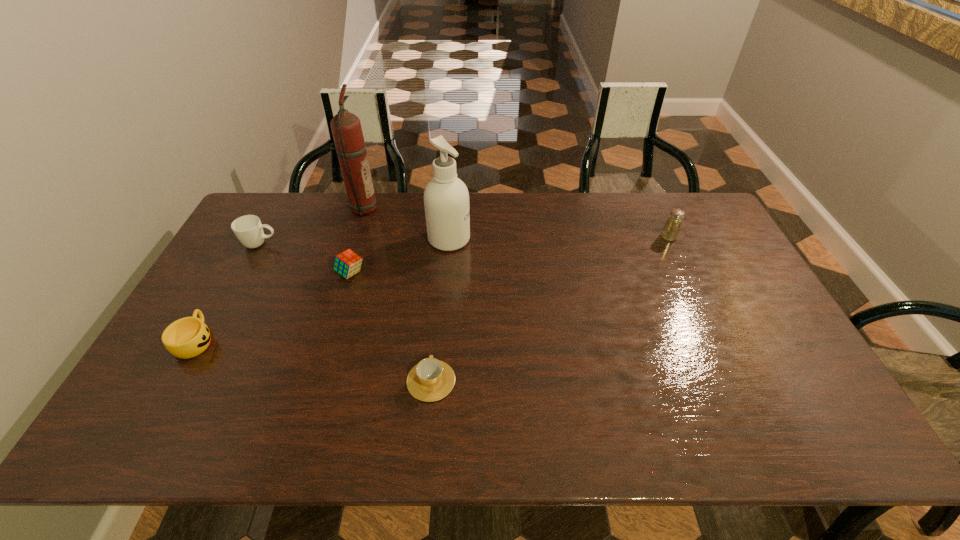
I want to click on vacant space located with the handle on the side of the farthest cup, so click(333, 244).

Find the location of a particular element. Image resolution: width=960 pixels, height=540 pixels. vacant space located 0.060m on the right of the fifth farthest object is located at coordinates (385, 273).

Where is `free spot located with the handle on the side of the rightmost cup`? The width and height of the screenshot is (960, 540). free spot located with the handle on the side of the rightmost cup is located at coordinates (440, 285).

Identify the location of vacant space located with the handle on the side of the rightmost cup. (435, 342).

Where is `free location located 0.290m with the handle on the side of the rightmost cup`? The image size is (960, 540). free location located 0.290m with the handle on the side of the rightmost cup is located at coordinates click(440, 280).

Where is `fire extinguisher positioned at the far edge`? The width and height of the screenshot is (960, 540). fire extinguisher positioned at the far edge is located at coordinates (346, 128).

This screenshot has width=960, height=540. I want to click on cleansing agent present at the far edge, so click(x=446, y=198).

Locate an element on the screen. This screenshot has width=960, height=540. saltshaker present at the far edge is located at coordinates (670, 232).

At what (x,y) coordinates should I click in order to perform the action: click on object at the right edge. Please return your answer as a coordinate pair (x, y). Looking at the image, I should click on (670, 232).

Locate an element on the screen. object located in the far right corner section of the desktop is located at coordinates (670, 232).